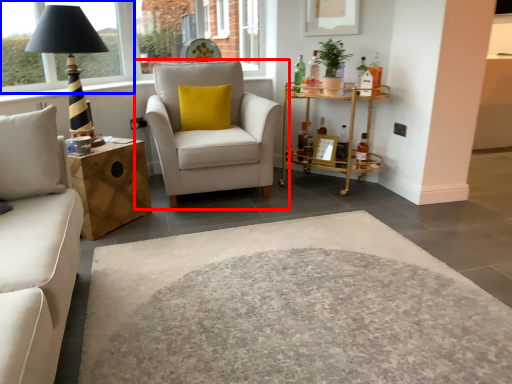
Question: Among these objects, which one is nearest to the camera, chair (highlighted by a red box) or window frame (highlighted by a blue box)?

Choices:
 (A) chair
 (B) window frame

Answer: (A)